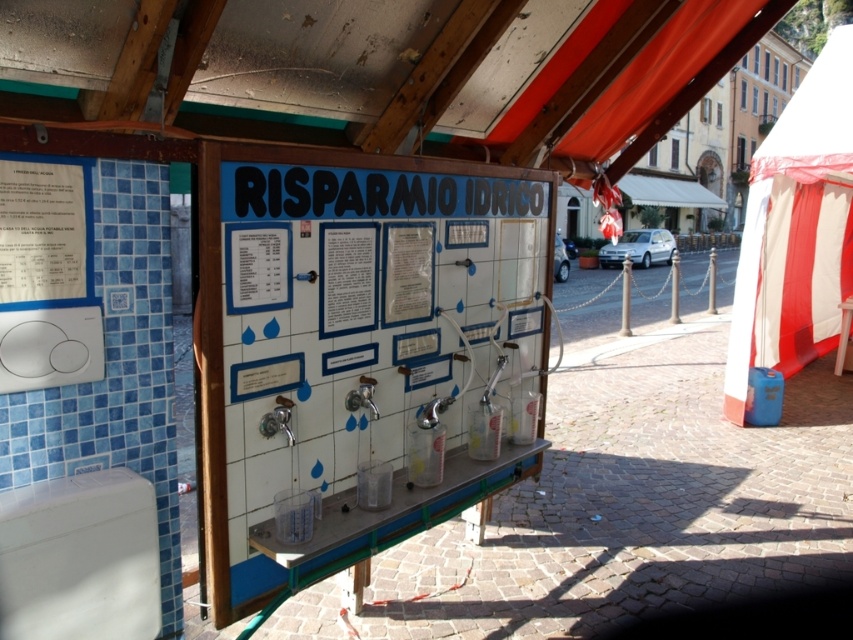
Question: Is white tile board at center thinner than white paper at left?

Choices:
 (A) no
 (B) yes

Answer: (A)

Question: Does white tile board at center have a greater width compared to white paper at left?

Choices:
 (A) no
 (B) yes

Answer: (B)

Question: Which object appears farthest from the camera in this image?

Choices:
 (A) white tile board at center
 (B) white paper at left

Answer: (A)

Question: Is white tile board at center thinner than white paper at left?

Choices:
 (A) yes
 (B) no

Answer: (B)